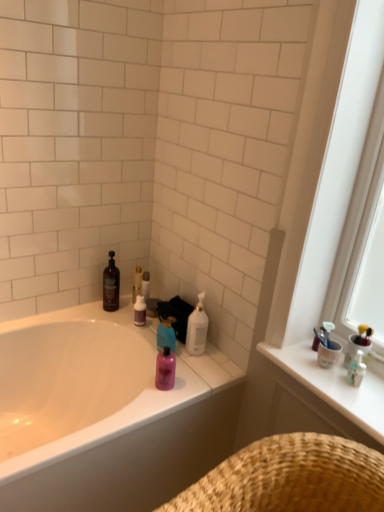
Find the location of a particular element. free space to the left of translucent plastic toothbrush holder at upper right, marked as the third toiletry in a back-to-front arrangement is located at coordinates (313, 373).